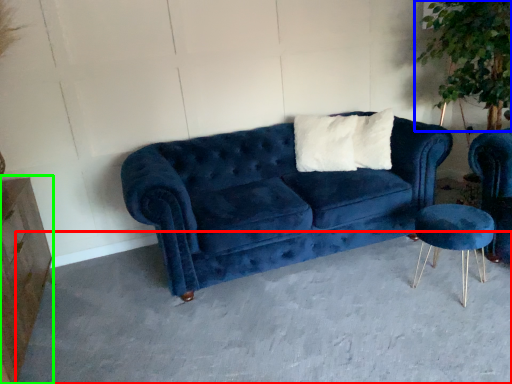
Question: Estimate the real-world distances between objects in this image. Which object is farther from concrete (highlighted by a red box), plant (highlighted by a blue box) or dresser (highlighted by a green box)?

Choices:
 (A) plant
 (B) dresser

Answer: (A)